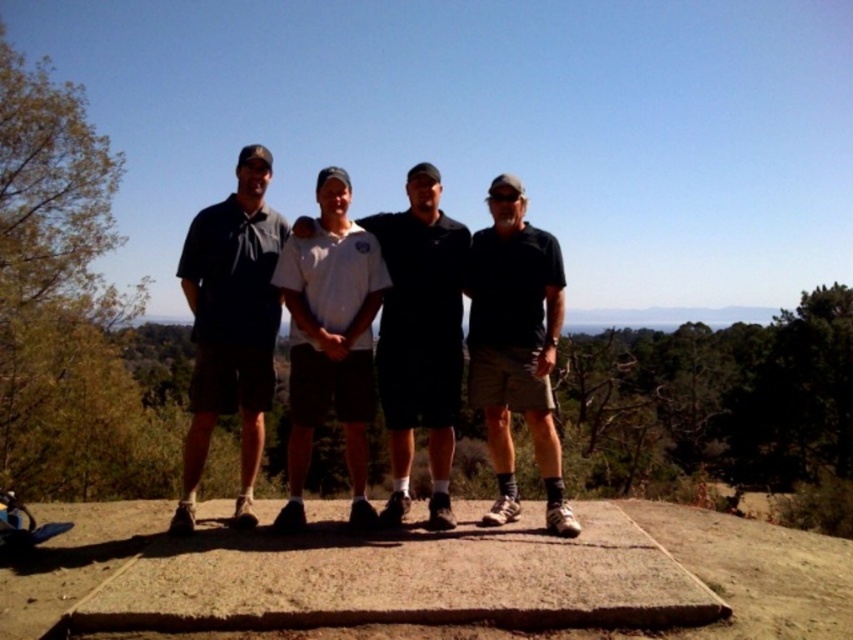
You are a photographer trying to capture a group photo of the dark gray fabric shirt at left and the white cotton shirt at center. Since you want to ensure both subjects are visible in the frame, which person should you position closer to the camera to avoid being cropped out?

The dark gray fabric shirt at left has a lesser height compared to white cotton shirt at center, so you should position the dark gray fabric shirt at left closer to the camera to ensure it is not cropped out.

You are a photographer planning to take a group photo of the four individuals standing on the concrete platform. You want to ensure that the dark gray fabric shirt at left and the black cotton shirt at right are both clearly visible in the frame. Considering their sizes, which shirt might require more space in the composition to avoid being cropped out?

The dark gray fabric shirt at left is larger in size than the black cotton shirt at right, so it might require more space in the composition to avoid being cropped out.